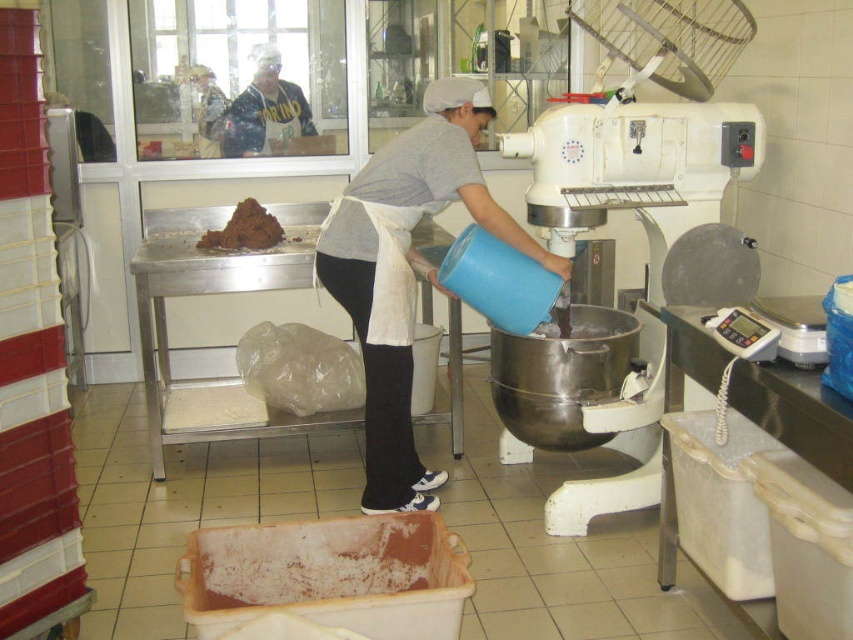
You are a baker in the kitchen and need to locate the stainless steel mixer at center. According to the coordinates provided, where exactly is it positioned?

The stainless steel mixer at center is positioned at coordinates point (645, 237).

Based on the scene described, which object is taller, the stainless steel mixer at center or the brown crumbly dough at upper center?

The stainless steel mixer at center is much taller than the brown crumbly dough at upper center according to the description.

You are standing in the kitchen and want to reach both points, point (410, 522) and point (245, 92). Which point should you reach first to minimize the distance walked?

Point (410, 522) is closer to the viewer than point (245, 92), so you should reach point (410, 522) first to minimize the distance walked.